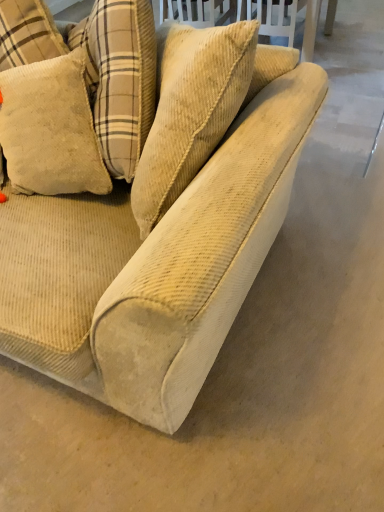
The image size is (384, 512). I want to click on beige corduroy couch at center, so click(142, 219).

The image size is (384, 512). What do you see at coordinates (142, 219) in the screenshot? I see `beige corduroy couch at center` at bounding box center [142, 219].

Where is `beige corduroy pillow at upper left`? beige corduroy pillow at upper left is located at coordinates (51, 129).

Measure the distance between point (12, 96) and camera.

The distance of point (12, 96) from camera is 1.20 meters.

The height and width of the screenshot is (512, 384). Describe the element at coordinates (51, 129) in the screenshot. I see `beige corduroy pillow at upper left` at that location.

The image size is (384, 512). What are the coordinates of `beige corduroy couch at center` in the screenshot? It's located at pyautogui.click(x=142, y=219).

Would you say beige corduroy couch at center is to the left or to the right of beige corduroy pillow at upper left in the picture?

beige corduroy couch at center is positioned on beige corduroy pillow at upper left's right side.

Which object is closer to the camera, beige corduroy couch at center or beige corduroy pillow at upper left?

beige corduroy couch at center is closer to the camera.

Is point (57, 143) positioned after point (45, 76)?

Yes, point (57, 143) is behind point (45, 76).

From the image's perspective, would you say beige corduroy couch at center is shown under beige corduroy pillow at upper left?

Yes.

From a real-world perspective, is beige corduroy couch at center below beige corduroy pillow at upper left?

Indeed, from a real-world perspective, beige corduroy couch at center is positioned beneath beige corduroy pillow at upper left.

Can you confirm if beige corduroy couch at center is thinner than beige corduroy pillow at upper left?

No, beige corduroy couch at center is not thinner than beige corduroy pillow at upper left.

Considering the relative sizes of beige corduroy couch at center and beige corduroy pillow at upper left in the image provided, is beige corduroy couch at center taller than beige corduroy pillow at upper left?

Yes.

Looking at the image, does beige corduroy couch at center seem bigger or smaller compared to beige corduroy pillow at upper left?

In the image, beige corduroy couch at center appears to be larger than beige corduroy pillow at upper left.

Is beige corduroy couch at center completely or partially outside of beige corduroy pillow at upper left?

beige corduroy couch at center is positioned outside beige corduroy pillow at upper left.

Is beige corduroy couch at center next to beige corduroy pillow at upper left?

No, beige corduroy couch at center is not with beige corduroy pillow at upper left.

Is beige corduroy couch at center looking in the opposite direction of beige corduroy pillow at upper left?

Yes, beige corduroy couch at center is positioned with its back facing beige corduroy pillow at upper left.

How distant is beige corduroy couch at center from beige corduroy pillow at upper left?

A distance of 8.97 inches exists between beige corduroy couch at center and beige corduroy pillow at upper left.

At what (x,y) coordinates should I click in order to perform the action: click on studio couch that is in front of the beige corduroy pillow at upper left. Please return your answer as a coordinate pair (x, y). The width and height of the screenshot is (384, 512). Looking at the image, I should click on (142, 219).

Between beige corduroy pillow at upper left and beige corduroy couch at center, which one appears on the right side from the viewer's perspective?

Positioned to the right is beige corduroy couch at center.

Considering their positions, is beige corduroy pillow at upper left located in front of or behind beige corduroy couch at center?

Clearly, beige corduroy pillow at upper left is behind beige corduroy couch at center.

Which is less distant, (61, 75) or (218, 301)?

The point (218, 301) is closer.

From the image's perspective, is beige corduroy pillow at upper left located beneath beige corduroy couch at center?

Incorrect, from the image's perspective, beige corduroy pillow at upper left is higher than beige corduroy couch at center.

From a real-world perspective, does beige corduroy pillow at upper left stand above beige corduroy couch at center?

Correct, in the physical world, beige corduroy pillow at upper left is higher than beige corduroy couch at center.

Looking at this image, which of these two, beige corduroy pillow at upper left or beige corduroy couch at center, is thinner?

With smaller width is beige corduroy pillow at upper left.

Considering the sizes of objects beige corduroy pillow at upper left and beige corduroy couch at center in the image provided, who is taller, beige corduroy pillow at upper left or beige corduroy couch at center?

Standing taller between the two is beige corduroy couch at center.

Considering the sizes of objects beige corduroy pillow at upper left and beige corduroy couch at center in the image provided, who is bigger, beige corduroy pillow at upper left or beige corduroy couch at center?

With larger size is beige corduroy couch at center.

Would you say beige corduroy pillow at upper left contains beige corduroy couch at center?

No, beige corduroy couch at center is not inside beige corduroy pillow at upper left.

Looking at this image, can you see beige corduroy pillow at upper left touching beige corduroy couch at center?

No, beige corduroy pillow at upper left is not beside beige corduroy couch at center.

Is beige corduroy pillow at upper left facing away from beige corduroy couch at center?

Yes, beige corduroy pillow at upper left is positioned with its back facing beige corduroy couch at center.

What's the angular difference between beige corduroy pillow at upper left and beige corduroy couch at center's facing directions?

4.68 degrees.

Find the location of `studio couch on the right of beige corduroy pillow at upper left`. studio couch on the right of beige corduroy pillow at upper left is located at coordinates [142, 219].

At what (x,y) coordinates should I click in order to perform the action: click on pillow above the beige corduroy couch at center (from a real-world perspective). Please return your answer as a coordinate pair (x, y). The width and height of the screenshot is (384, 512). Looking at the image, I should click on (51, 129).

Where is `pillow above the beige corduroy couch at center (from the image's perspective)`? pillow above the beige corduroy couch at center (from the image's perspective) is located at coordinates (51, 129).